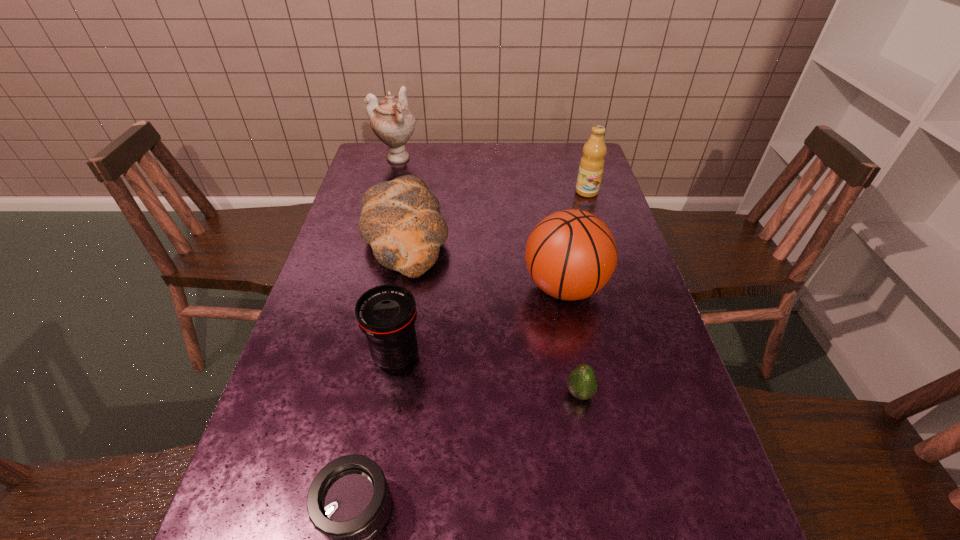
Identify the location of vacant space at the right edge. This screenshot has height=540, width=960. (588, 204).

The height and width of the screenshot is (540, 960). I want to click on free region at the far right corner, so click(582, 155).

You are a GUI agent. You are given a task and a screenshot of the screen. Output one action in this format:
    pyautogui.click(x=<x>, y=<y>)
    Task: Click on the vacant area between the urn and the avocado
    The height and width of the screenshot is (540, 960).
    Given the screenshot: What is the action you would take?
    pyautogui.click(x=489, y=276)

Locate an element on the screen. empty location between the basketball and the fifth tallest object is located at coordinates (485, 261).

Find the location of a particular element. The width and height of the screenshot is (960, 540). free space between the farthest object and the basketball is located at coordinates (481, 223).

Where is `object identified as the second closest to the farthest object`? This screenshot has width=960, height=540. object identified as the second closest to the farthest object is located at coordinates (591, 167).

The image size is (960, 540). In order to click on the fourth closest object to the olive oil in this screenshot , I will do `click(582, 382)`.

Identify the location of vacant area in the image that satisfies the following two spatial constraints: 1. on the front side of the bread; 2. on the right side of the farther telephoto lens. The height and width of the screenshot is (540, 960). (x=381, y=356).

Image resolution: width=960 pixels, height=540 pixels. What are the coordinates of `free spot that satisfies the following two spatial constraints: 1. on the back side of the basketball; 2. on the right side of the third nearest object` in the screenshot? It's located at (407, 287).

Locate an element on the screen. This screenshot has width=960, height=540. vacant space that satisfies the following two spatial constraints: 1. on the back side of the basketball; 2. on the right side of the second nearest object is located at coordinates (561, 287).